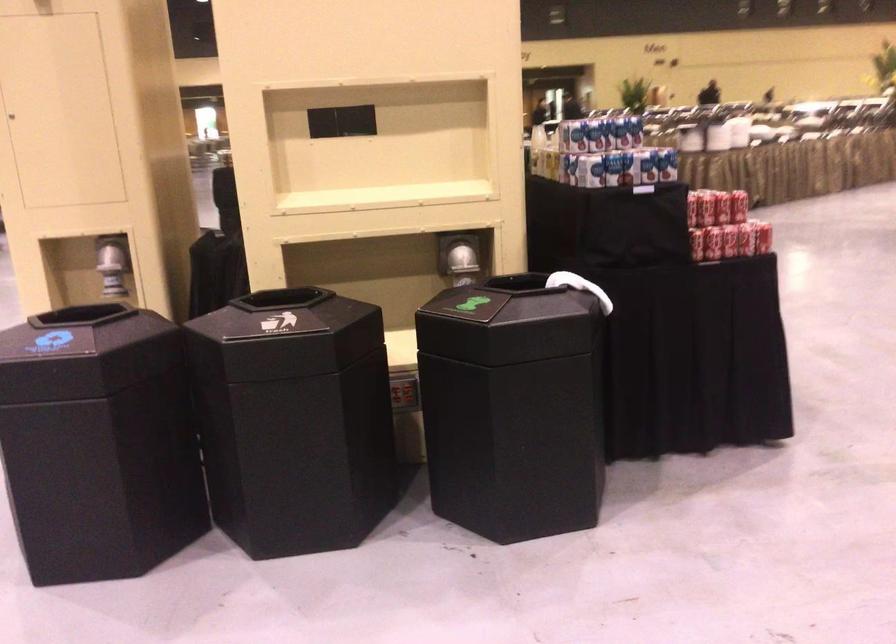
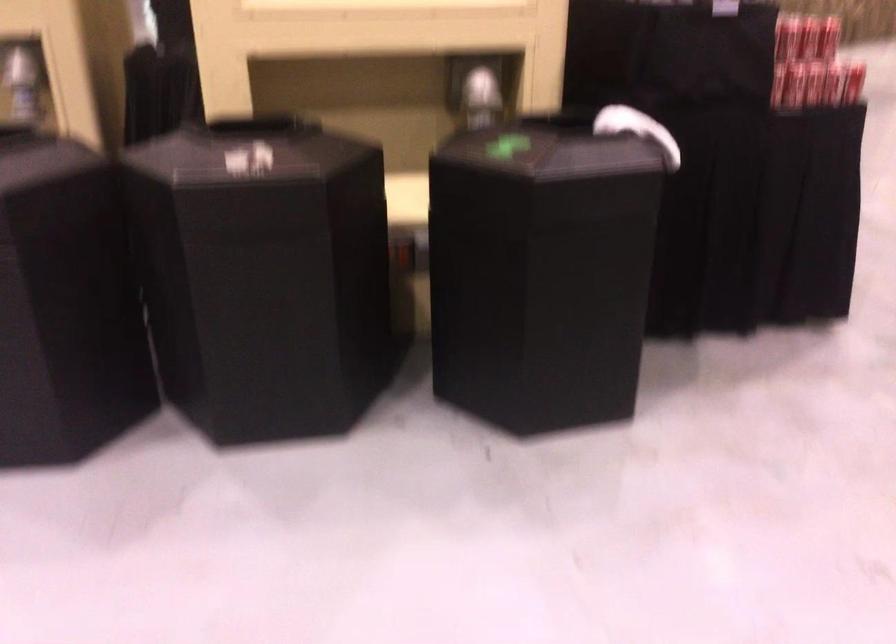
Which direction would the cameraman need to move to produce the second image?

The movement direction of the cameraman is left, forward.